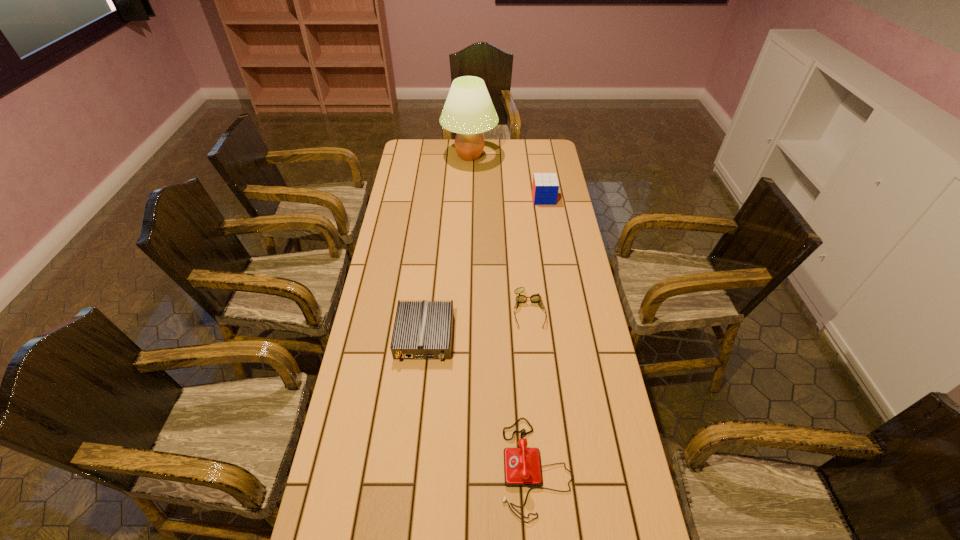
Locate an element on the screen. free space between the router and the shortest object is located at coordinates (477, 323).

The image size is (960, 540). I want to click on free spot between the shortest object and the cube, so click(x=537, y=254).

Identify which object is the third nearest to the telephone. Please provide its 2D coordinates. Your answer should be formatted as a tuple, i.e. [(x, y)], where the tuple contains the x and y coordinates of a point satisfying the conditions above.

[(545, 187)]

Locate an element on the screen. The height and width of the screenshot is (540, 960). object that stands as the fourth closest to the router is located at coordinates (468, 111).

You are a GUI agent. You are given a task and a screenshot of the screen. Output one action in this format:
    pyautogui.click(x=<x>, y=<y>)
    Task: Click on the vacant region that satisfies the following two spatial constraints: 1. on the shade of the tallest object; 2. on the right side of the second tallest object
    This screenshot has height=540, width=960.
    Given the screenshot: What is the action you would take?
    pyautogui.click(x=468, y=198)

Locate an element on the screen. This screenshot has height=540, width=960. vacant space that satisfies the following two spatial constraints: 1. on the front-facing side of the spectacles; 2. on the dial of the telephone is located at coordinates (544, 467).

Find the location of a particular element. vacant space that satisfies the following two spatial constraints: 1. on the front-facing side of the spectacles; 2. on the dial of the telephone is located at coordinates (x=544, y=467).

Locate an element on the screen. This screenshot has width=960, height=540. free spot that satisfies the following two spatial constraints: 1. on the shade of the farthest object; 2. on the back panel of the router is located at coordinates (465, 336).

The image size is (960, 540). Find the location of `free spot that satisfies the following two spatial constraints: 1. on the shade of the tallest object; 2. on the back panel of the router`. free spot that satisfies the following two spatial constraints: 1. on the shade of the tallest object; 2. on the back panel of the router is located at coordinates (465, 336).

Identify the location of vacant space that satisfies the following two spatial constraints: 1. on the front-facing side of the shortest object; 2. on the dial of the telephone. This screenshot has height=540, width=960. pyautogui.click(x=544, y=467).